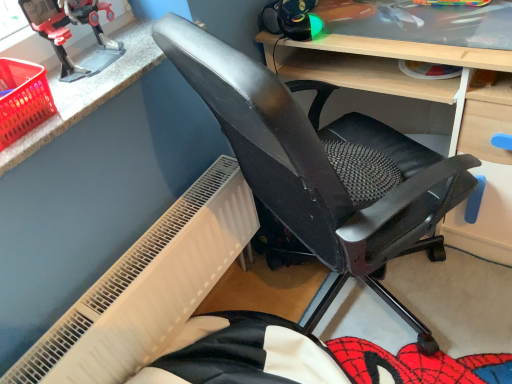
Identify the location of empty space that is ontop of white textured radiator at lower left. The width and height of the screenshot is (512, 384). pos(141,256).